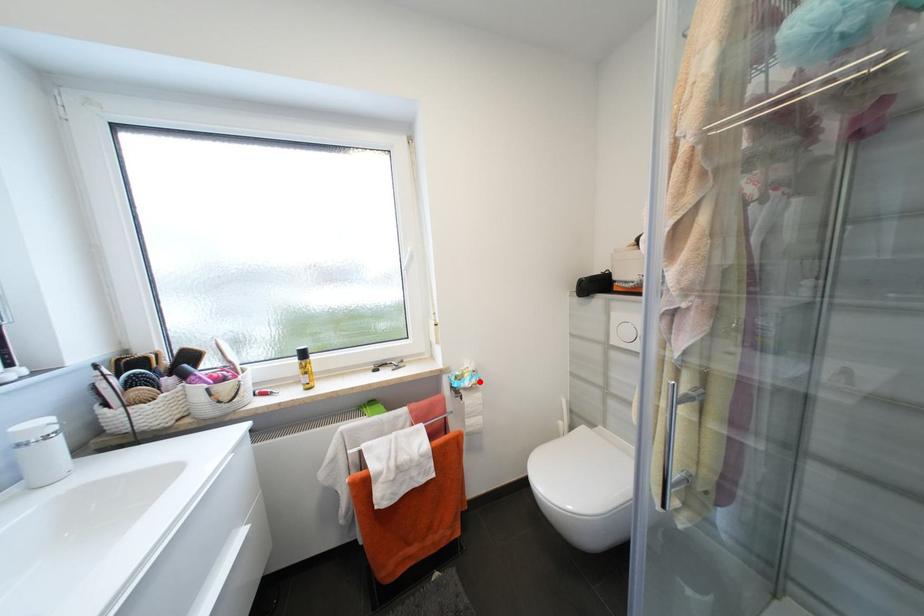
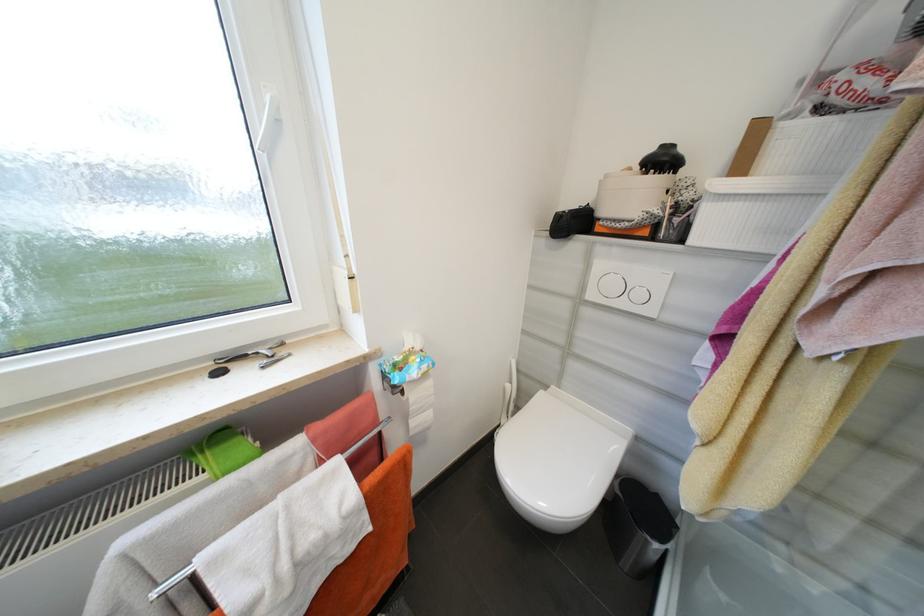
Where in the second image is the point corresponding to the highlighted location from the first image?

(430, 368)